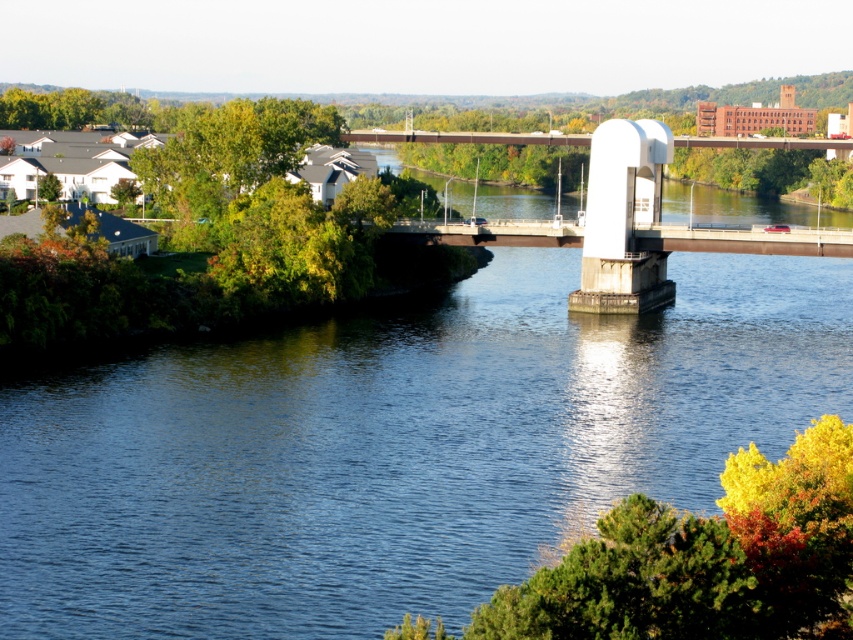
Question: Is blue concrete river at center below white concrete pedestal at center?

Choices:
 (A) no
 (B) yes

Answer: (B)

Question: Among these objects, which one is nearest to the camera?

Choices:
 (A) blue concrete river at center
 (B) white concrete pedestal at center

Answer: (A)

Question: Is blue concrete river at center further to the viewer compared to white concrete pedestal at center?

Choices:
 (A) yes
 (B) no

Answer: (B)

Question: Can you confirm if blue concrete river at center is smaller than white concrete pedestal at center?

Choices:
 (A) yes
 (B) no

Answer: (A)

Question: Which point appears closest to the camera in this image?

Choices:
 (A) (358, 602)
 (B) (416, 132)

Answer: (A)